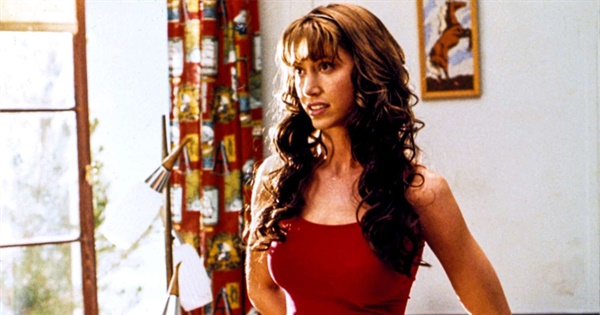
Locate an element on the screen. The width and height of the screenshot is (600, 315). lamp is located at coordinates (165, 167).